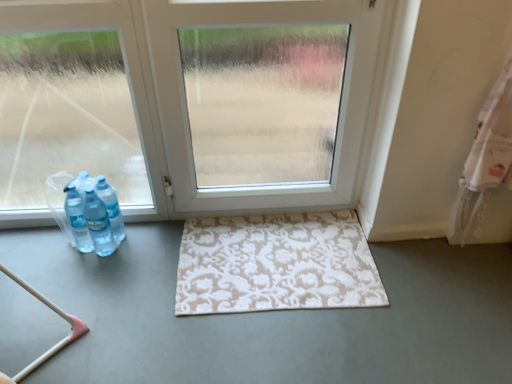
Question: From the image's perspective, is translucent plastic bottles at left above beige patterned rug at center?

Choices:
 (A) no
 (B) yes

Answer: (B)

Question: Can you confirm if translucent plastic bottles at left is smaller than beige patterned rug at center?

Choices:
 (A) no
 (B) yes

Answer: (A)

Question: Is translucent plastic bottles at left taller than beige patterned rug at center?

Choices:
 (A) yes
 (B) no

Answer: (A)

Question: Is translucent plastic bottles at left turned away from beige patterned rug at center?

Choices:
 (A) no
 (B) yes

Answer: (A)

Question: Considering the relative positions of translucent plastic bottles at left and beige patterned rug at center in the image provided, is translucent plastic bottles at left to the right of beige patterned rug at center from the viewer's perspective?

Choices:
 (A) no
 (B) yes

Answer: (A)

Question: Is point (467, 329) closer or farther from the camera than point (340, 266)?

Choices:
 (A) farther
 (B) closer

Answer: (B)

Question: Is white matte rug at center taller or shorter than beige patterned rug at center?

Choices:
 (A) short
 (B) tall

Answer: (B)

Question: Considering the positions of white matte rug at center and beige patterned rug at center in the image, is white matte rug at center wider or thinner than beige patterned rug at center?

Choices:
 (A) wide
 (B) thin

Answer: (A)

Question: From the image's perspective, relative to beige patterned rug at center, is white matte rug at center above or below?

Choices:
 (A) above
 (B) below

Answer: (B)

Question: From a real-world perspective, is white matte rug at center physically located above or below white matte door at center?

Choices:
 (A) below
 (B) above

Answer: (A)

Question: Is white matte rug at center bigger or smaller than white matte door at center?

Choices:
 (A) small
 (B) big

Answer: (B)

Question: Which is correct: white matte rug at center is inside white matte door at center, or outside of it?

Choices:
 (A) outside
 (B) inside

Answer: (A)

Question: From the image's perspective, is white matte rug at center located above or below white matte door at center?

Choices:
 (A) below
 (B) above

Answer: (A)

Question: Does point (283, 192) appear closer or farther from the camera than point (195, 339)?

Choices:
 (A) farther
 (B) closer

Answer: (A)

Question: From the image's perspective, is white matte door at center positioned above or below white matte rug at center?

Choices:
 (A) below
 (B) above

Answer: (B)